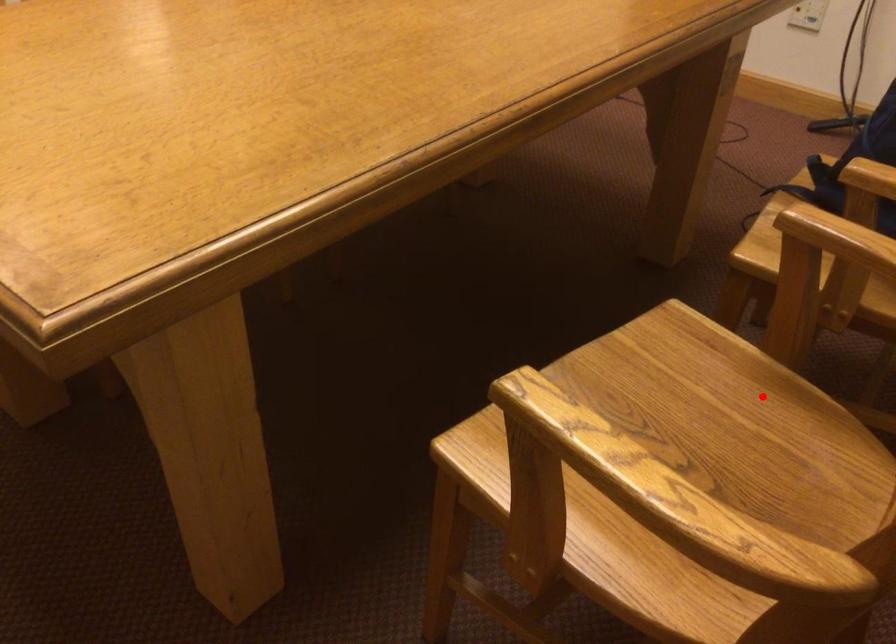
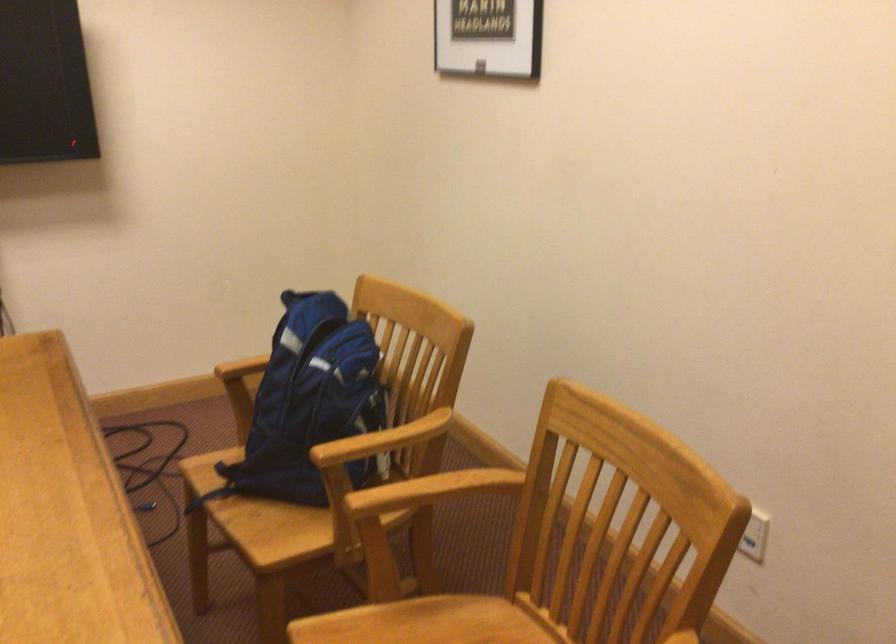
Question: I am providing you with two images of the same scene from different viewpoints. Given a red point in image1, look at the same physical point in image2. Is it:

Choices:
 (A) Closer to the viewpoint
 (B) Farther from the viewpoint

Answer: (B)